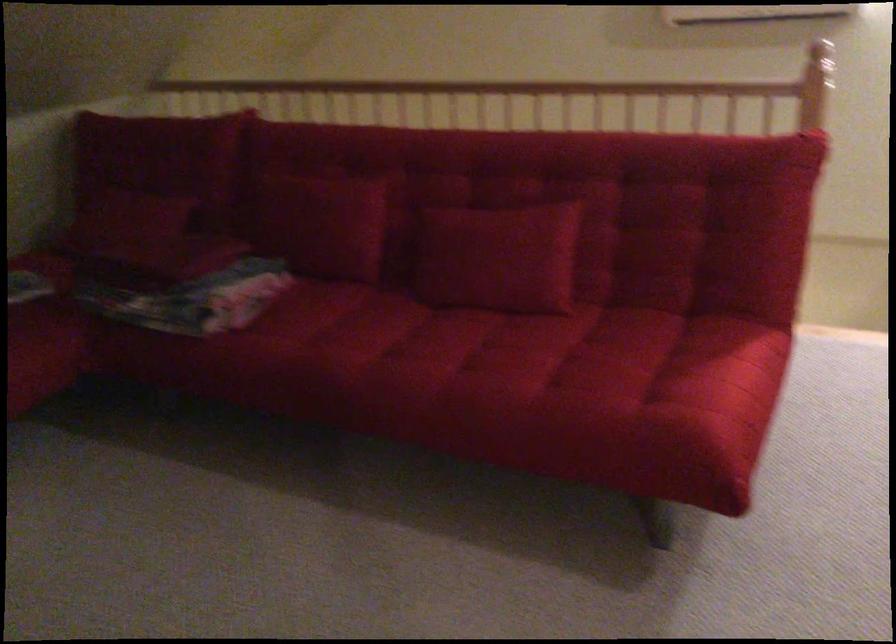
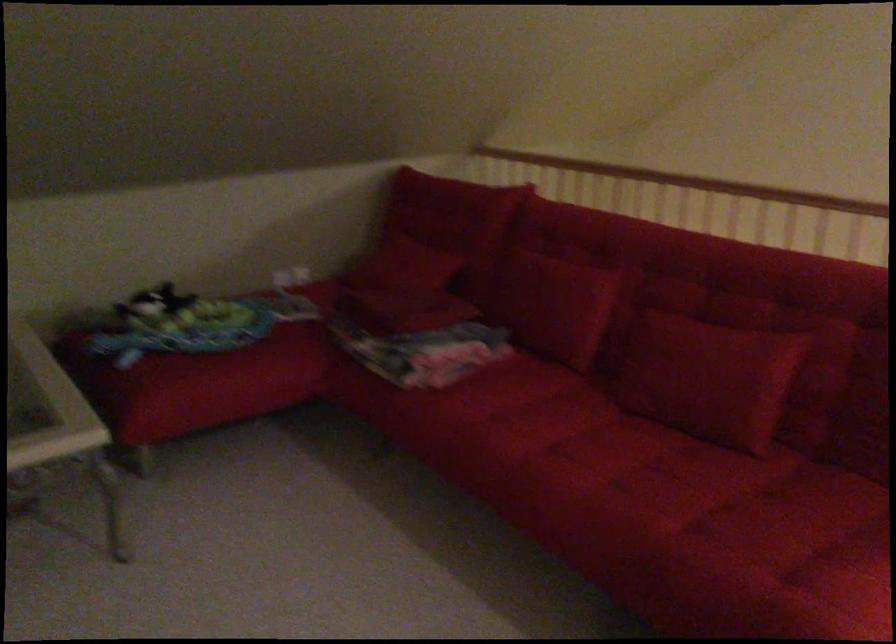
The images are taken continuously from a first-person perspective. In which direction are you moving?

The movement direction of the cameraman is right, forward.